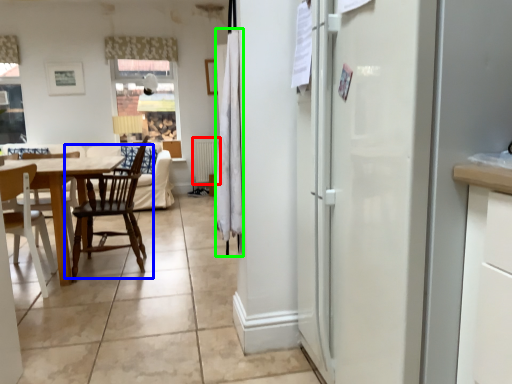
Question: Which object is positioned farthest from radiator (highlighted by a red box)? Select from chair (highlighted by a blue box) and curtain (highlighted by a green box).

Choices:
 (A) chair
 (B) curtain

Answer: (B)